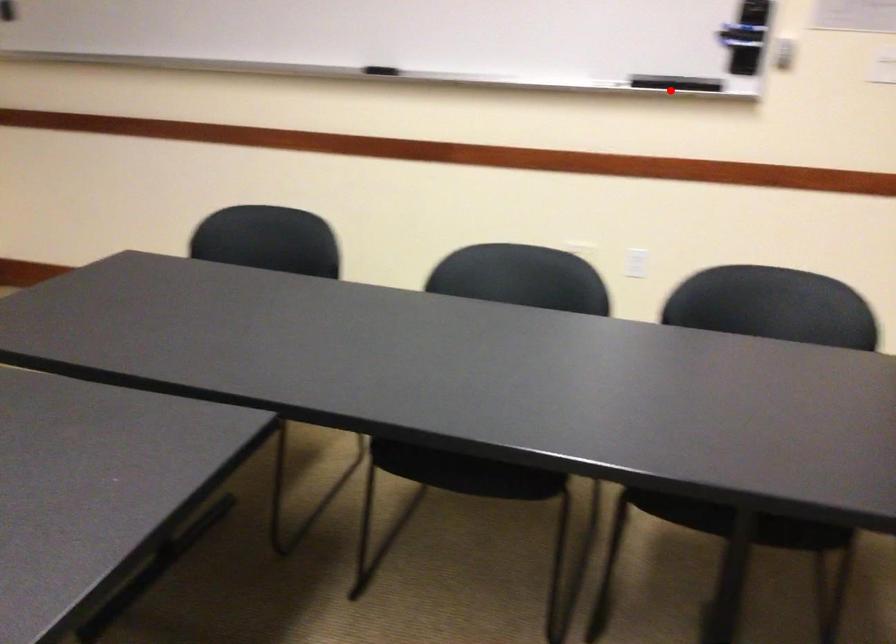
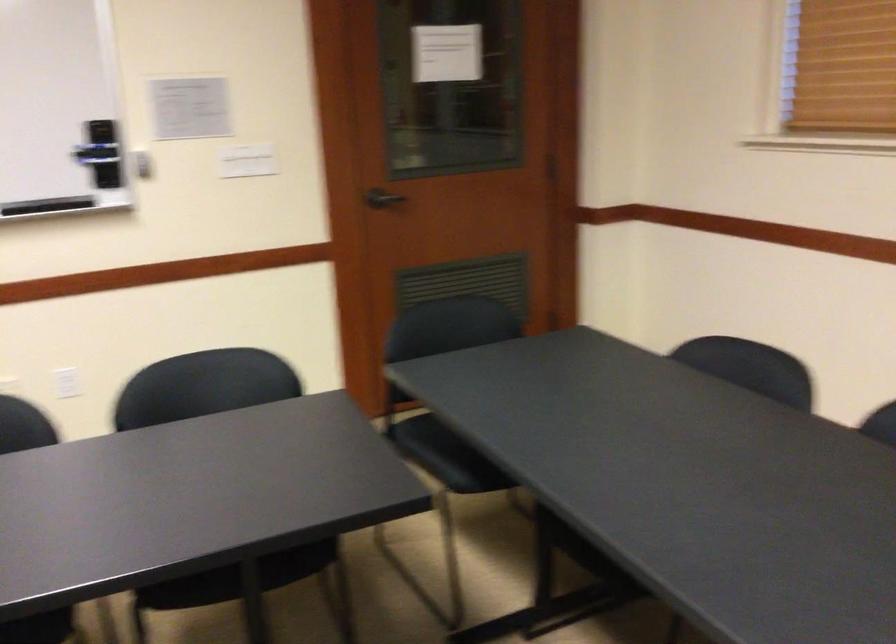
Locate, in the second image, the point that corresponds to the highlighted location in the first image.

(46, 205)